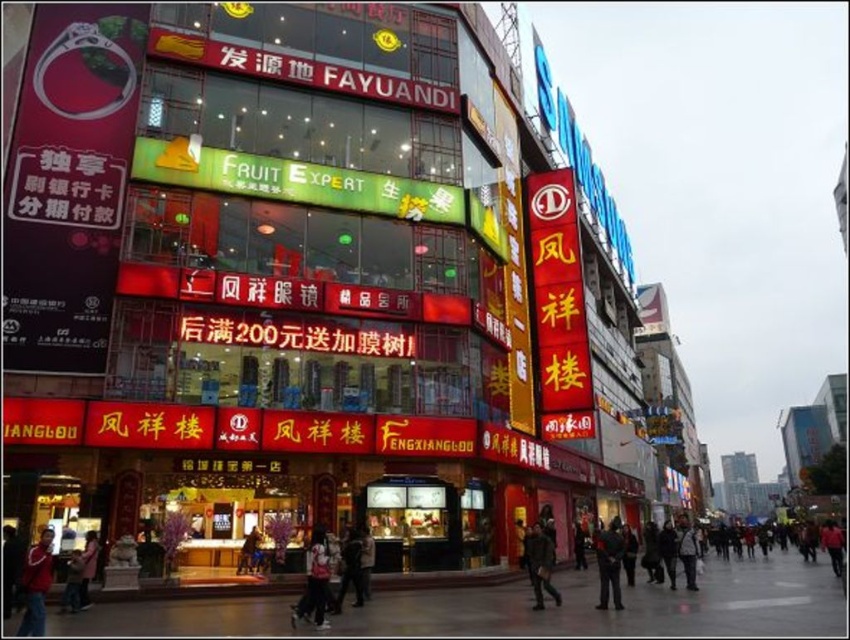
You are a pedestrian walking on the street and see two dark gray jackets displayed in the store windows. The jackets are labeled as the dark gray jacket at lower center and the dark gray jacket at lower right. Which jacket is positioned lower in the window?

The dark gray jacket at lower center is located below the dark gray jacket at lower right, so the dark gray jacket at lower center is positioned lower in the window.